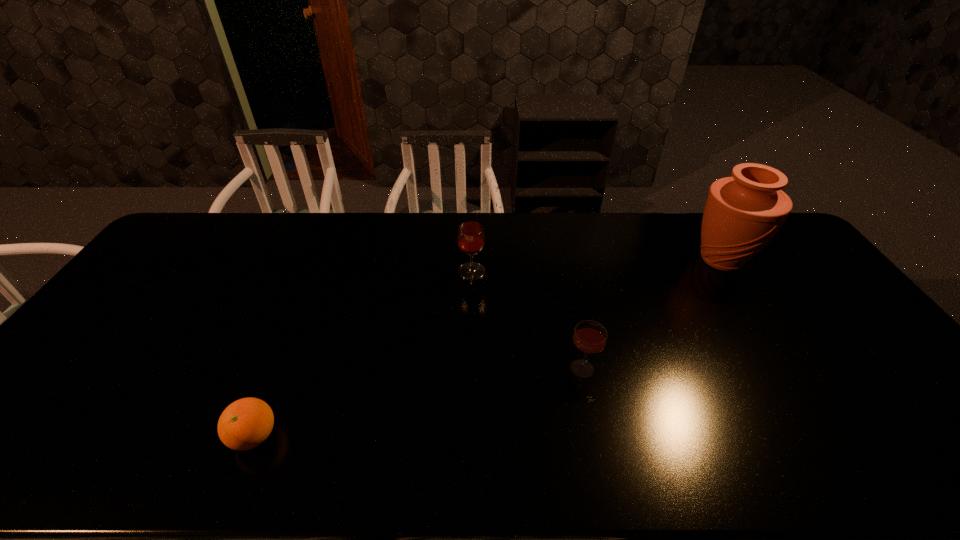
Where is `free space that satisfies the following two spatial constraints: 1. on the back side of the leftmost object; 2. on the left side of the tallest object`? The width and height of the screenshot is (960, 540). free space that satisfies the following two spatial constraints: 1. on the back side of the leftmost object; 2. on the left side of the tallest object is located at coordinates (325, 260).